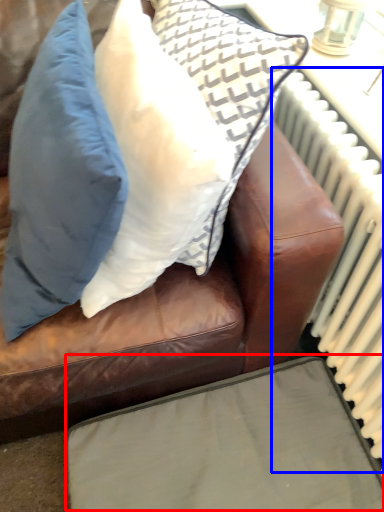
Question: Which object is closer to the camera taking this photo, furniture (highlighted by a red box) or radiator (highlighted by a blue box)?

Choices:
 (A) furniture
 (B) radiator

Answer: (B)